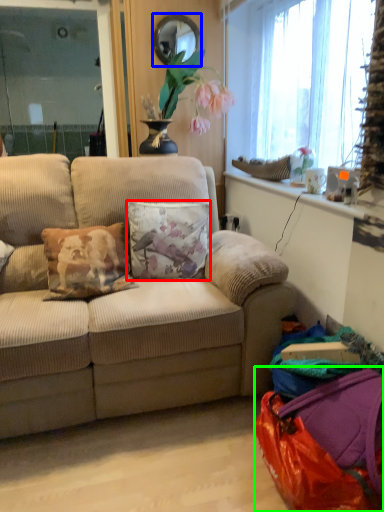
Question: Which object is the closest to the pillow (highlighted by a red box)? Choose among these: mirror (highlighted by a blue box) or bag (highlighted by a green box).

Choices:
 (A) mirror
 (B) bag

Answer: (B)